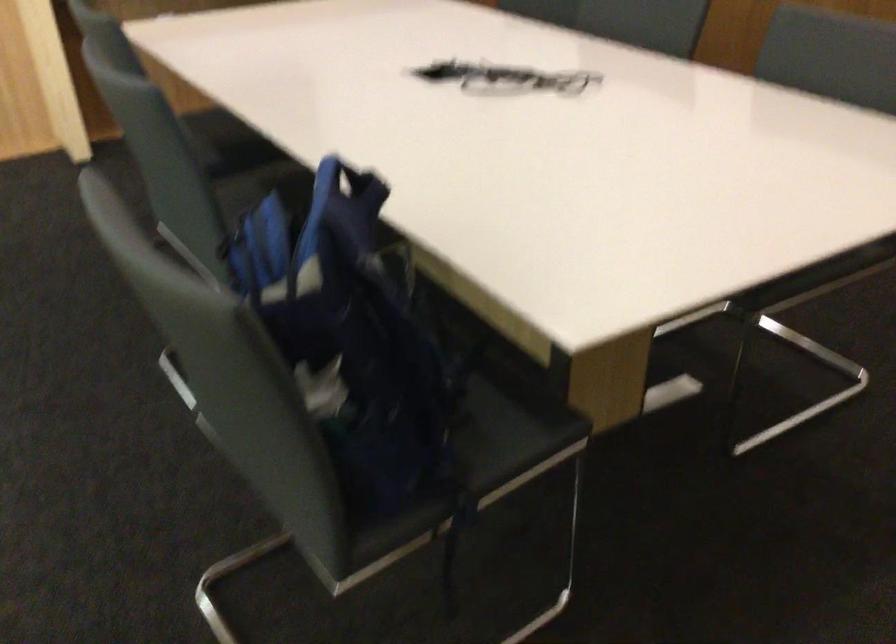
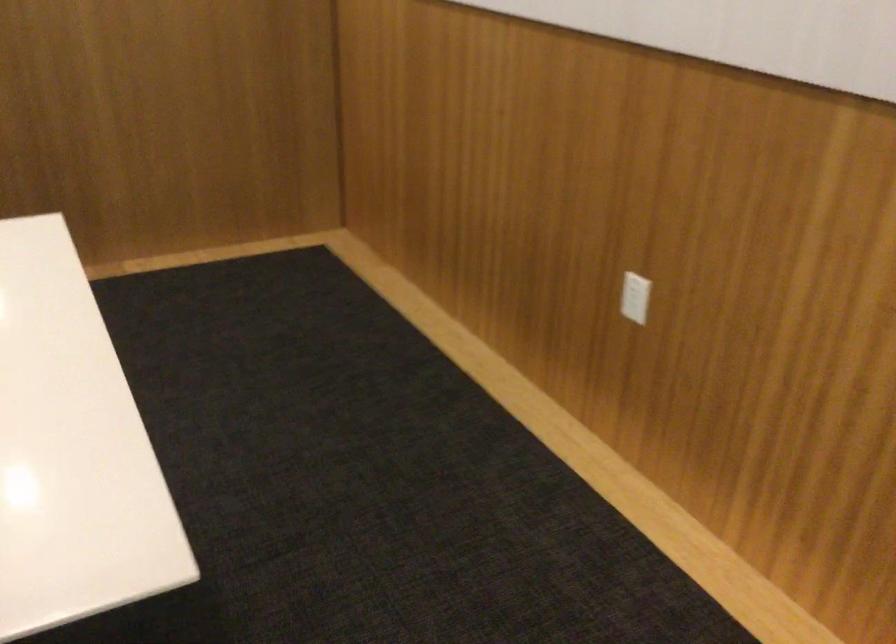
How did the camera likely rotate?

The camera's rotation is toward right-down.